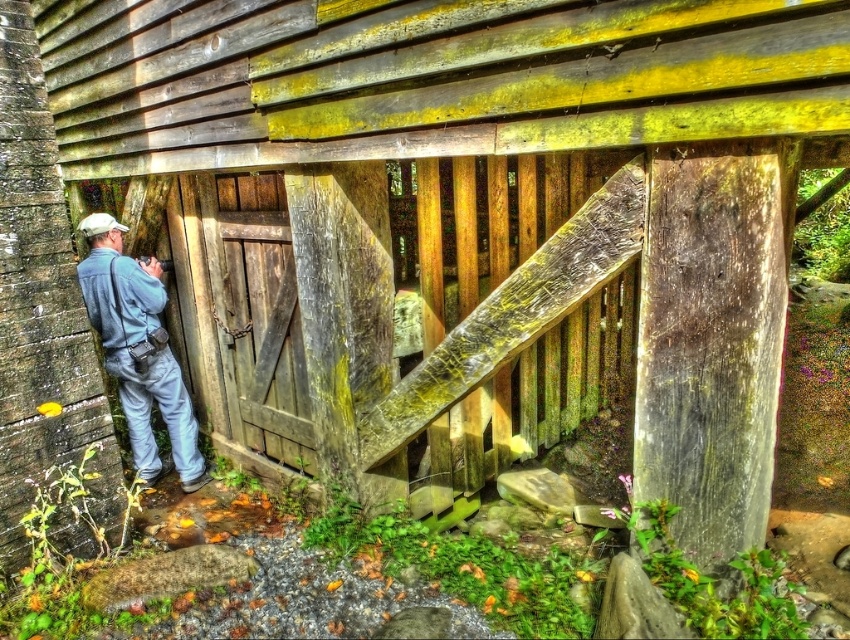
Question: Which of the following is the closest to the observer?

Choices:
 (A) weathered wood barn door at center
 (B) blue denim jumpsuit at left

Answer: (A)

Question: Can you confirm if weathered wood barn door at center is smaller than blue denim jumpsuit at left?

Choices:
 (A) yes
 (B) no

Answer: (B)

Question: Can you confirm if weathered wood barn door at center is positioned to the right of blue denim jumpsuit at left?

Choices:
 (A) no
 (B) yes

Answer: (B)

Question: Among these objects, which one is nearest to the camera?

Choices:
 (A) blue denim jumpsuit at left
 (B) weathered wood barn door at center

Answer: (B)

Question: Is weathered wood barn door at center positioned before blue denim jumpsuit at left?

Choices:
 (A) no
 (B) yes

Answer: (B)